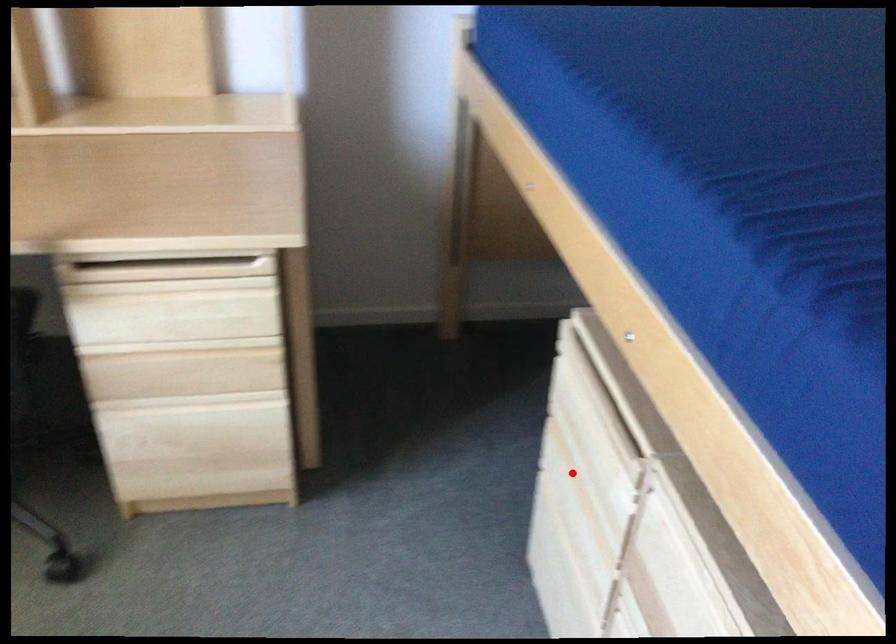
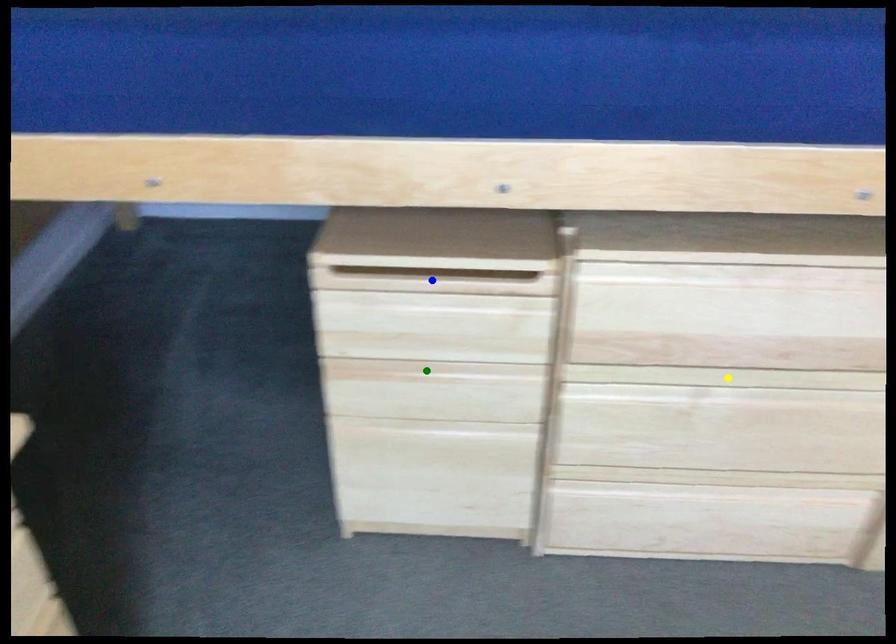
Question: I am providing you with two images of the same scene from different viewpoints. A red point is marked on the first image. You are given multiple points on the second image. Can you choose the point in image 2 that corresponds to the point in image 1?

Choices:
 (A) green point
 (B) blue point
 (C) yellow point

Answer: (A)